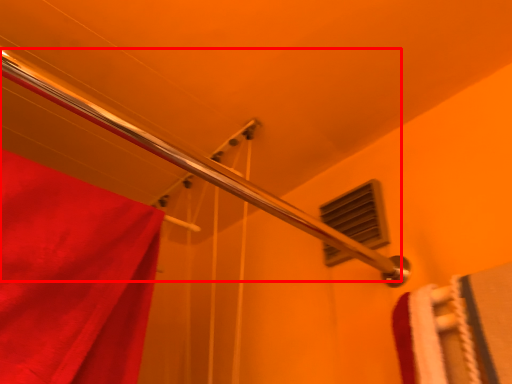
Question: Observing the image, what is the correct spatial positioning of shower (annotated by the red box) in reference to window?

Choices:
 (A) right
 (B) left

Answer: (B)